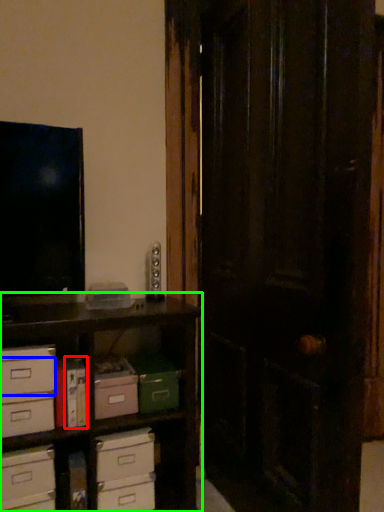
Question: Considering the real-world distances, which object is closest to book (highlighted by a red box)? drawer (highlighted by a blue box) or shelf (highlighted by a green box).

Choices:
 (A) drawer
 (B) shelf

Answer: (A)